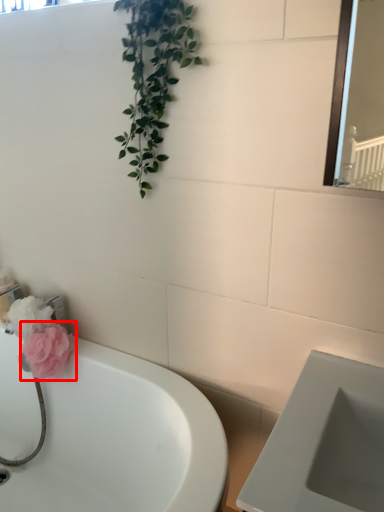
Question: From the image, what is the correct spatial relationship of flower (annotated by the red box) in relation to bathtub?

Choices:
 (A) right
 (B) left

Answer: (A)